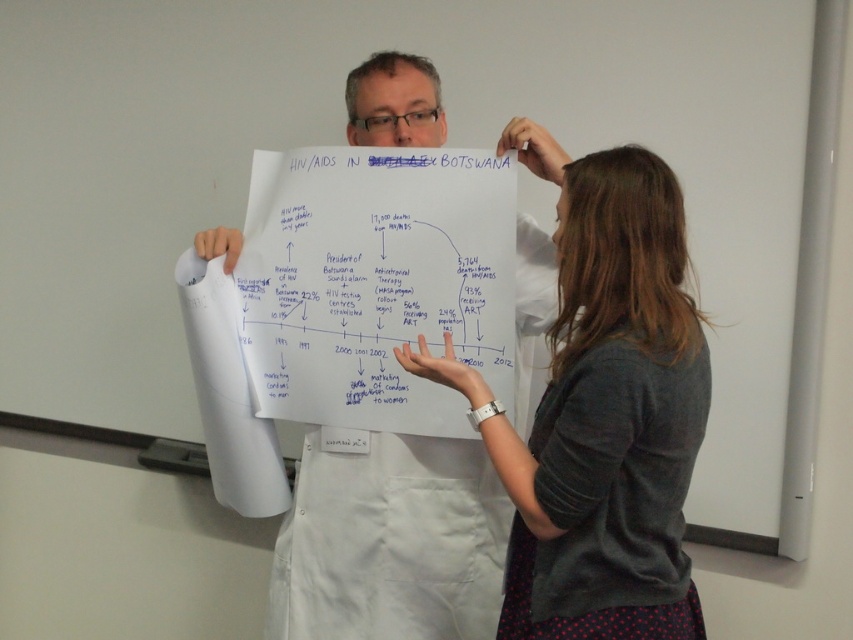
You are a photographer standing 5 feet away from the gray cotton shirt at center and the white paper at center. You want to take a photo that includes both objects in focus. The camera you are using has a depth of field that can cover 12 inches. Will both objects be in focus?

The distance between the gray cotton shirt at center and the white paper at center is 11.85 inches, which is within the camera s 12 inch depth of field. Therefore, both objects will be in focus.

You are a photographer adjusting your camera to focus on two specific points in the image. The first point is at coordinates point (656, 595) and the second is at point (519, 157). Which point should you focus on first if you want to capture the closest object to the camera?

Point (656, 595) is closer to the camera than point (519, 157), so you should focus on point (656, 595) first to capture the closest object.

You are a photographer standing in front of the two people in the scene. You want to take a photo that includes both the gray cotton shirt at center and the white paper at center. Which object should you focus on first to ensure both are in sharp focus?

You should focus on the gray cotton shirt at center first because it is closer to the viewer than the white paper at center, ensuring both will be in focus when using a proper depth of field.